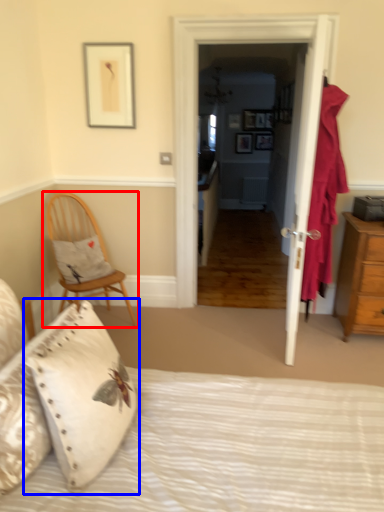
Question: Which object appears farthest to the camera in this image, chair (highlighted by a red box) or pillow (highlighted by a blue box)?

Choices:
 (A) chair
 (B) pillow

Answer: (A)